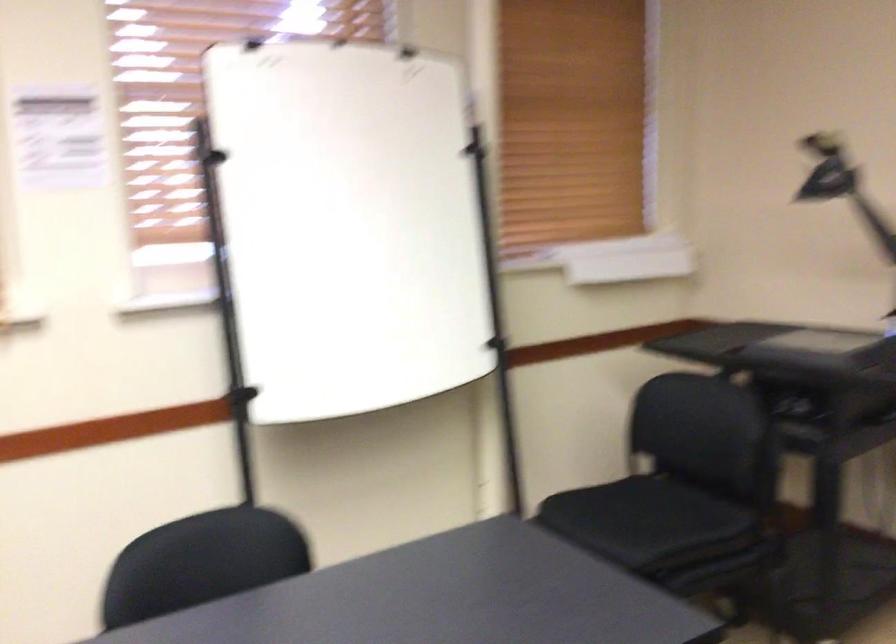
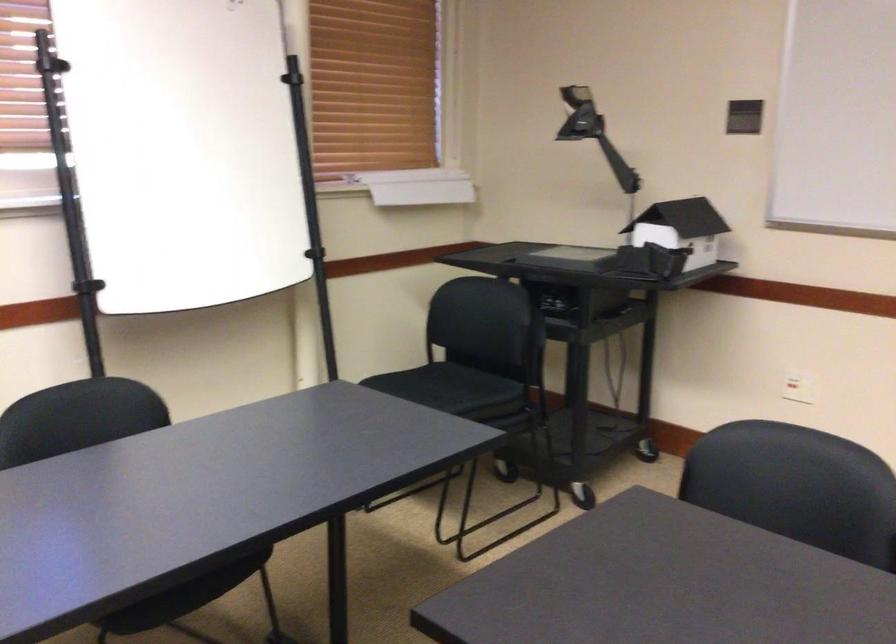
Find the pixel in the second image that matches (819,167) in the first image.

(579, 115)